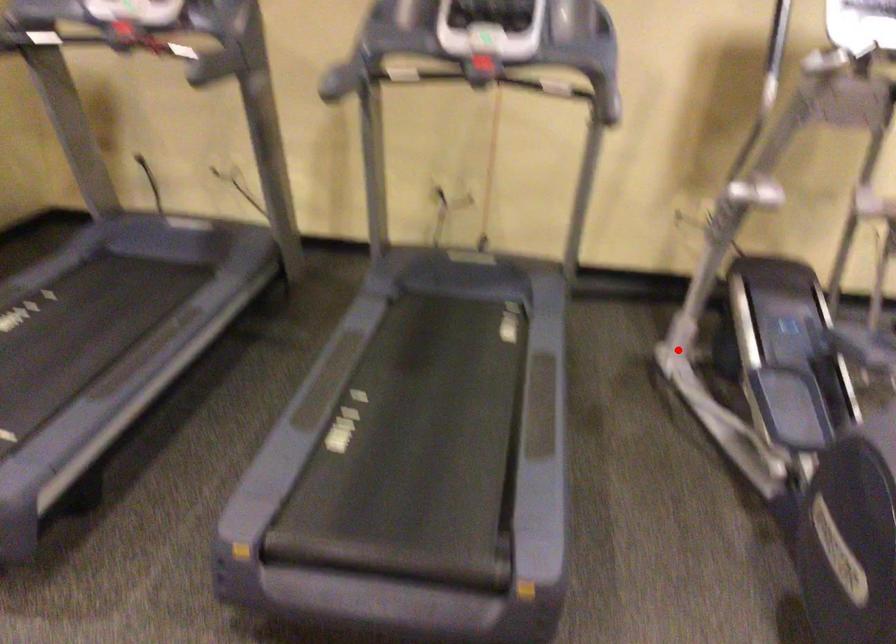
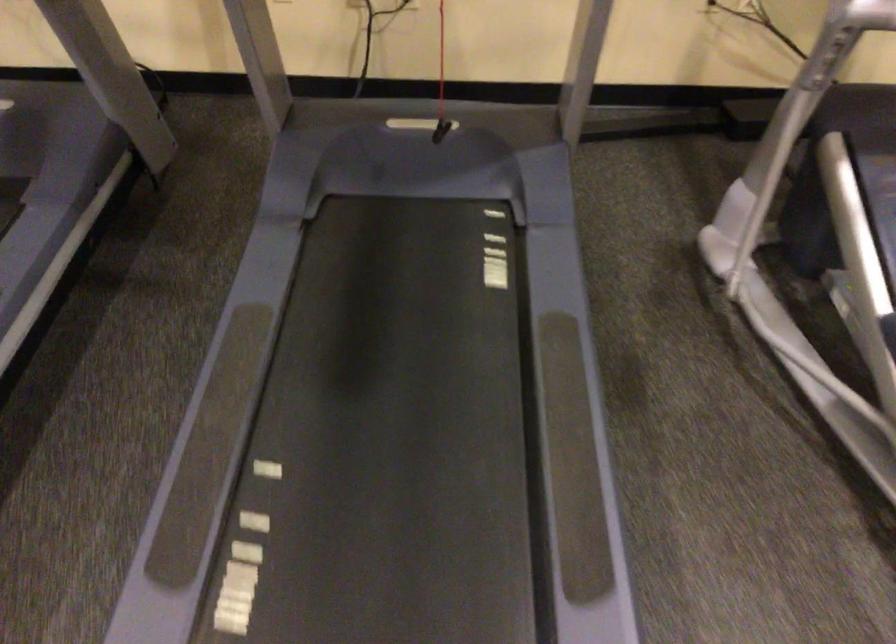
The point at the highlighted location is marked in the first image. Where is the corresponding point in the second image?

(721, 240)